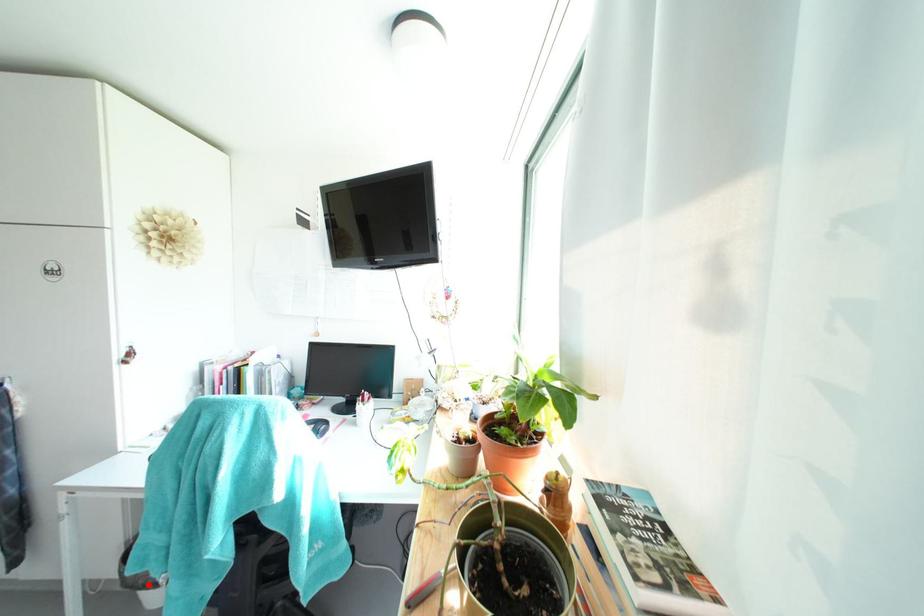
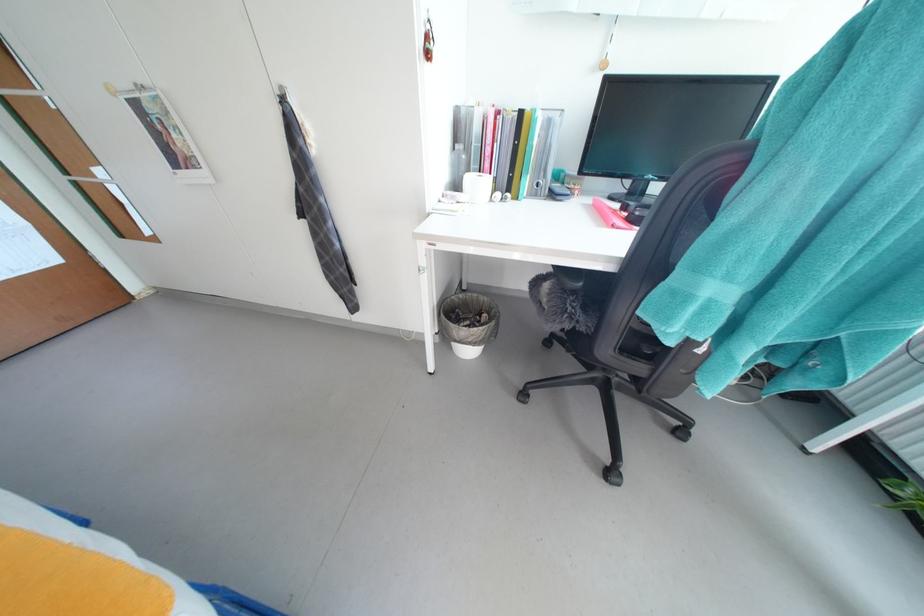
In the second image, find the point that corresponds to the highlighted location in the first image.

(478, 342)